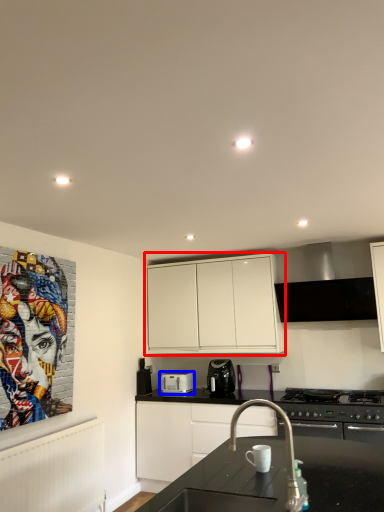
Question: Which of the following is the closest to the observer, cabinetry (highlighted by a red box) or kitchen appliance (highlighted by a blue box)?

Choices:
 (A) cabinetry
 (B) kitchen appliance

Answer: (A)